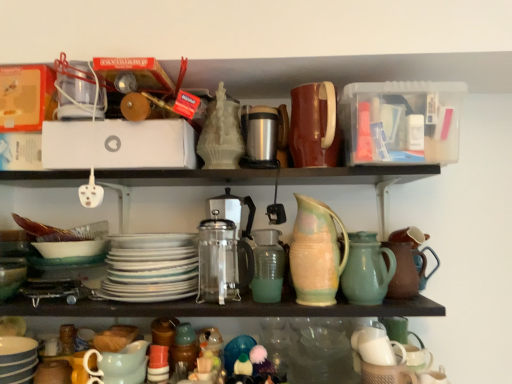
Question: Is white glossy platter at center taller or shorter than translucent glass vase at center?

Choices:
 (A) tall
 (B) short

Answer: (A)

Question: Considering the positions of point (116, 294) and point (268, 253), is point (116, 294) closer or farther from the camera than point (268, 253)?

Choices:
 (A) closer
 (B) farther

Answer: (B)

Question: Which is nearer to the pastel glazed pitcher at center, the first jug from the left?

Choices:
 (A) teal ceramic jug at center-right, the 1th jug when ordered from right to left
 (B) matte ceramic pitcher at lower left, arranged as the first tableware when ordered from the bottom
 (C) translucent glass vase at center
 (D) translucent glass cups at lower center
 (E) satin silver coffee machine at center

Answer: (A)

Question: Considering the real-world distances, which object is closest to the translucent glass vase at center?

Choices:
 (A) matte green mixing bowl at lower left
 (B) teal ceramic jug at center-right, the 1th jug when ordered from right to left
 (C) striped ceramic bowls at lower left, acting as the second tableware starting from the bottom
 (D) brown matte tea pot at right
 (E) matte ceramic pitcher at lower left, arranged as the 2th tableware when viewed from the left

Answer: (B)